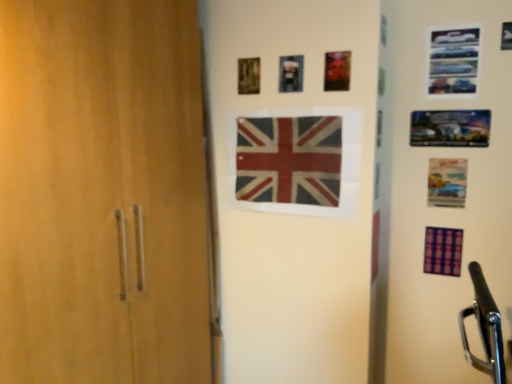
This screenshot has width=512, height=384. What do you see at coordinates (248, 76) in the screenshot?
I see `wooden picture frame at upper center, which is the fourth picture frame in right-to-left order` at bounding box center [248, 76].

The width and height of the screenshot is (512, 384). What do you see at coordinates (453, 61) in the screenshot?
I see `metallic blue picture frame at upper right, which ranks as the 1th picture frame in right-to-left order` at bounding box center [453, 61].

The height and width of the screenshot is (384, 512). I want to click on metallic photo frame at upper right, which is the 3th picture frame in left-to-right order, so click(x=450, y=128).

There is a purple fabric flag at lower right, which is the 1th flag from right to left. Identify the location of the 2nd picture frame above it (from the image's perspective). Image resolution: width=512 pixels, height=384 pixels. (291, 73).

From the image's perspective, which object appears higher, metallic silver picture frame at upper center, placed as the 2th picture frame when sorted from left to right, or purple fabric flag at lower right, marked as the 1th flag in a bottom-to-top arrangement?

metallic silver picture frame at upper center, placed as the 2th picture frame when sorted from left to right, appears higher in the image.

From the picture: Is metallic silver picture frame at upper center, acting as the 3th picture frame starting from the right, next to purple fabric flag at lower right, which is the 1th flag from right to left?

They are not placed beside each other.

Is metallic blue picture frame at upper right, which appears as the fourth picture frame when viewed from the left, to the left of purple fabric flag at lower right, the 2th flag when ordered from top to bottom, from the viewer's perspective?

Yes, metallic blue picture frame at upper right, which appears as the fourth picture frame when viewed from the left, is to the left of purple fabric flag at lower right, the 2th flag when ordered from top to bottom.

Is metallic blue picture frame at upper right, which ranks as the 1th picture frame in right-to-left order, positioned with its back to purple fabric flag at lower right, the 2th flag when ordered from top to bottom?

metallic blue picture frame at upper right, which ranks as the 1th picture frame in right-to-left order, is not turned away from purple fabric flag at lower right, the 2th flag when ordered from top to bottom.

From the picture: From a real-world perspective, is metallic blue picture frame at upper right, which ranks as the 1th picture frame in right-to-left order, physically located above or below purple fabric flag at lower right, marked as the 1th flag in a bottom-to-top arrangement?

From a real-world perspective, metallic blue picture frame at upper right, which ranks as the 1th picture frame in right-to-left order, is physically above purple fabric flag at lower right, marked as the 1th flag in a bottom-to-top arrangement.

Considering the positions of objects red and white fabric flag at center, the 2th flag positioned from the bottom, and metallic silver picture frame at upper center, placed as the 2th picture frame when sorted from left to right, in the image provided, who is in front, red and white fabric flag at center, the 2th flag positioned from the bottom, or metallic silver picture frame at upper center, placed as the 2th picture frame when sorted from left to right,?

red and white fabric flag at center, the 2th flag positioned from the bottom, is closer to the camera.

Is metallic silver picture frame at upper center, acting as the 3th picture frame starting from the right, inside red and white fabric flag at center, the 1th flag positioned from the top?

Definitely not — metallic silver picture frame at upper center, acting as the 3th picture frame starting from the right, is not inside red and white fabric flag at center, the 1th flag positioned from the top.

Considering the sizes of red and white fabric flag at center, placed as the 1th flag when sorted from left to right, and metallic silver picture frame at upper center, acting as the 3th picture frame starting from the right, in the image, is red and white fabric flag at center, placed as the 1th flag when sorted from left to right, bigger or smaller than metallic silver picture frame at upper center, acting as the 3th picture frame starting from the right,?

Clearly, red and white fabric flag at center, placed as the 1th flag when sorted from left to right, is larger in size than metallic silver picture frame at upper center, acting as the 3th picture frame starting from the right.

Which point is more forward, (320, 159) or (280, 89)?

The point (320, 159) is in front.

In the scene shown: Considering the relative sizes of purple fabric flag at lower right, the 2th flag when ordered from top to bottom, and metallic blue picture frame at upper right, which ranks as the 1th picture frame in right-to-left order, in the image provided, is purple fabric flag at lower right, the 2th flag when ordered from top to bottom, taller than metallic blue picture frame at upper right, which ranks as the 1th picture frame in right-to-left order,?

Incorrect, the height of purple fabric flag at lower right, the 2th flag when ordered from top to bottom, is not larger of that of metallic blue picture frame at upper right, which ranks as the 1th picture frame in right-to-left order.

From a real-world perspective, between purple fabric flag at lower right, the 2th flag when ordered from top to bottom, and metallic blue picture frame at upper right, which appears as the fourth picture frame when viewed from the left, who is vertically higher?

metallic blue picture frame at upper right, which appears as the fourth picture frame when viewed from the left, from a real-world perspective.

Is purple fabric flag at lower right, which is counted as the 2th flag, starting from the left, beside metallic blue picture frame at upper right, which appears as the fourth picture frame when viewed from the left?

No, purple fabric flag at lower right, which is counted as the 2th flag, starting from the left, is not touching metallic blue picture frame at upper right, which appears as the fourth picture frame when viewed from the left.

Is purple fabric flag at lower right, the 2th flag when ordered from top to bottom, positioned beyond the bounds of metallic blue picture frame at upper right, which ranks as the 1th picture frame in right-to-left order?

Yes.

Does metallic photo frame at upper right, positioned as the second picture frame in right-to-left order, come behind metallic blue picture frame at upper right, which ranks as the 1th picture frame in right-to-left order?

Yes, it is behind metallic blue picture frame at upper right, which ranks as the 1th picture frame in right-to-left order.

Where is `picture frame located in front of the metallic photo frame at upper right, positioned as the second picture frame in right-to-left order`? The width and height of the screenshot is (512, 384). picture frame located in front of the metallic photo frame at upper right, positioned as the second picture frame in right-to-left order is located at coordinates (453, 61).

Is metallic photo frame at upper right, which is the 3th picture frame in left-to-right order, inside or outside of metallic blue picture frame at upper right, which ranks as the 1th picture frame in right-to-left order?

metallic photo frame at upper right, which is the 3th picture frame in left-to-right order, is located beyond the bounds of metallic blue picture frame at upper right, which ranks as the 1th picture frame in right-to-left order.

How much distance is there between metallic photo frame at upper right, which is the 3th picture frame in left-to-right order, and metallic blue picture frame at upper right, which ranks as the 1th picture frame in right-to-left order?

They are 7.10 inches apart.

Visually, is metallic photo frame at upper right, positioned as the second picture frame in right-to-left order, positioned to the left or to the right of purple fabric flag at lower right, the 2th flag when ordered from top to bottom?

Clearly, metallic photo frame at upper right, positioned as the second picture frame in right-to-left order, is on the left of purple fabric flag at lower right, the 2th flag when ordered from top to bottom, in the image.

From the image's perspective, is metallic photo frame at upper right, positioned as the second picture frame in right-to-left order, on top of purple fabric flag at lower right, the 2th flag when ordered from top to bottom?

Yes.

Who is shorter, metallic photo frame at upper right, which is the 3th picture frame in left-to-right order, or purple fabric flag at lower right, which is the 1th flag from right to left?

metallic photo frame at upper right, which is the 3th picture frame in left-to-right order.

In the scene shown: Is there a large distance between metallic photo frame at upper right, which is the 3th picture frame in left-to-right order, and wooden picture frame at upper center, placed as the first picture frame when sorted from left to right?

metallic photo frame at upper right, which is the 3th picture frame in left-to-right order, is actually quite close to wooden picture frame at upper center, placed as the first picture frame when sorted from left to right.

From a real-world perspective, who is located higher, metallic photo frame at upper right, positioned as the second picture frame in right-to-left order, or wooden picture frame at upper center, placed as the first picture frame when sorted from left to right?

wooden picture frame at upper center, placed as the first picture frame when sorted from left to right, from a real-world perspective.

Which point is more distant from viewer, (468, 123) or (250, 67)?

The point (250, 67) is more distant.

Where is `picture frame that is the 2nd one when counting forward from the purple fabric flag at lower right, the 2th flag when ordered from top to bottom`? The image size is (512, 384). picture frame that is the 2nd one when counting forward from the purple fabric flag at lower right, the 2th flag when ordered from top to bottom is located at coordinates (291, 73).

You are a GUI agent. You are given a task and a screenshot of the screen. Output one action in this format:
    pyautogui.click(x=<x>, y=<y>)
    Task: Click on the flag on the right side of metallic blue picture frame at upper right, which appears as the fourth picture frame when viewed from the left
    Image resolution: width=512 pixels, height=384 pixels.
    Given the screenshot: What is the action you would take?
    pyautogui.click(x=443, y=251)

Looking at the image, which one is located closer to purple fabric flag at lower right, which is counted as the 2th flag, starting from the left, wooden picture frame at upper center, which is the fourth picture frame in right-to-left order, or metallic photo frame at upper right, positioned as the second picture frame in right-to-left order?

The object closer to purple fabric flag at lower right, which is counted as the 2th flag, starting from the left, is metallic photo frame at upper right, positioned as the second picture frame in right-to-left order.

Consider the image. When comparing their distances from metallic photo frame at upper right, which is the 3th picture frame in left-to-right order, does wooden picture frame at upper center, which is the fourth picture frame in right-to-left order, or metallic silver picture frame at upper center, placed as the 2th picture frame when sorted from left to right, seem further?

The object further to metallic photo frame at upper right, which is the 3th picture frame in left-to-right order, is wooden picture frame at upper center, which is the fourth picture frame in right-to-left order.

Estimate the real-world distances between objects in this image. Which object is closer to red and white fabric flag at center, placed as the 1th flag when sorted from left to right, metallic photo frame at upper right, positioned as the second picture frame in right-to-left order, or purple fabric flag at lower right, the 2th flag when ordered from top to bottom?

metallic photo frame at upper right, positioned as the second picture frame in right-to-left order.

Looking at the image, which one is located closer to metallic silver picture frame at upper center, placed as the 2th picture frame when sorted from left to right, metallic blue picture frame at upper right, which ranks as the 1th picture frame in right-to-left order, or wooden picture frame at upper center, placed as the first picture frame when sorted from left to right?

Based on the image, wooden picture frame at upper center, placed as the first picture frame when sorted from left to right, appears to be nearer to metallic silver picture frame at upper center, placed as the 2th picture frame when sorted from left to right.

Based on their spatial positions, is purple fabric flag at lower right, which is the 1th flag from right to left, or wooden picture frame at upper center, which is the fourth picture frame in right-to-left order, closer to metallic photo frame at upper right, which is the 3th picture frame in left-to-right order?

purple fabric flag at lower right, which is the 1th flag from right to left, is positioned closer to the anchor metallic photo frame at upper right, which is the 3th picture frame in left-to-right order.

From the image, which object appears to be farther from metallic photo frame at upper right, positioned as the second picture frame in right-to-left order, purple fabric flag at lower right, the 2th flag when ordered from top to bottom, or metallic silver picture frame at upper center, placed as the 2th picture frame when sorted from left to right?

metallic silver picture frame at upper center, placed as the 2th picture frame when sorted from left to right, is positioned further to the anchor metallic photo frame at upper right, positioned as the second picture frame in right-to-left order.

Which object lies further to the anchor point wooden picture frame at upper center, which is the fourth picture frame in right-to-left order, purple fabric flag at lower right, the 2th flag when ordered from top to bottom, or metallic silver picture frame at upper center, acting as the 3th picture frame starting from the right?

Among the two, purple fabric flag at lower right, the 2th flag when ordered from top to bottom, is located further to wooden picture frame at upper center, which is the fourth picture frame in right-to-left order.

From the image, which object appears to be farther from purple fabric flag at lower right, the 2th flag when ordered from top to bottom, metallic blue picture frame at upper right, which ranks as the 1th picture frame in right-to-left order, or wooden picture frame at upper center, which is the fourth picture frame in right-to-left order?

wooden picture frame at upper center, which is the fourth picture frame in right-to-left order, is further to purple fabric flag at lower right, the 2th flag when ordered from top to bottom.

This screenshot has height=384, width=512. Find the location of `picture frame between wooden picture frame at upper center, which is the fourth picture frame in right-to-left order, and metallic photo frame at upper right, positioned as the second picture frame in right-to-left order, from left to right`. picture frame between wooden picture frame at upper center, which is the fourth picture frame in right-to-left order, and metallic photo frame at upper right, positioned as the second picture frame in right-to-left order, from left to right is located at coordinates (291, 73).

Find the location of `flag between wooden picture frame at upper center, placed as the first picture frame when sorted from left to right, and purple fabric flag at lower right, the 2th flag when ordered from top to bottom, in the horizontal direction`. flag between wooden picture frame at upper center, placed as the first picture frame when sorted from left to right, and purple fabric flag at lower right, the 2th flag when ordered from top to bottom, in the horizontal direction is located at coordinates (289, 160).

At what (x,y) coordinates should I click in order to perform the action: click on flag located between wooden picture frame at upper center, which is the fourth picture frame in right-to-left order, and metallic photo frame at upper right, which is the 3th picture frame in left-to-right order, in the left-right direction. Please return your answer as a coordinate pair (x, y). This screenshot has width=512, height=384. Looking at the image, I should click on (289, 160).

You are a GUI agent. You are given a task and a screenshot of the screen. Output one action in this format:
    pyautogui.click(x=<x>, y=<y>)
    Task: Click on the picture frame situated between metallic silver picture frame at upper center, acting as the 3th picture frame starting from the right, and metallic blue picture frame at upper right, which appears as the fourth picture frame when viewed from the left, from left to right
    The height and width of the screenshot is (384, 512).
    Given the screenshot: What is the action you would take?
    pyautogui.click(x=450, y=128)